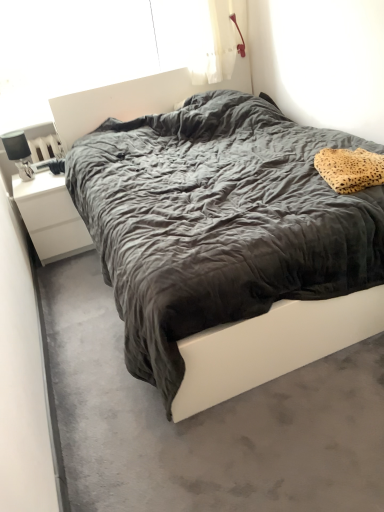
I want to click on free spot in front of white matte nightstand at left, so click(70, 271).